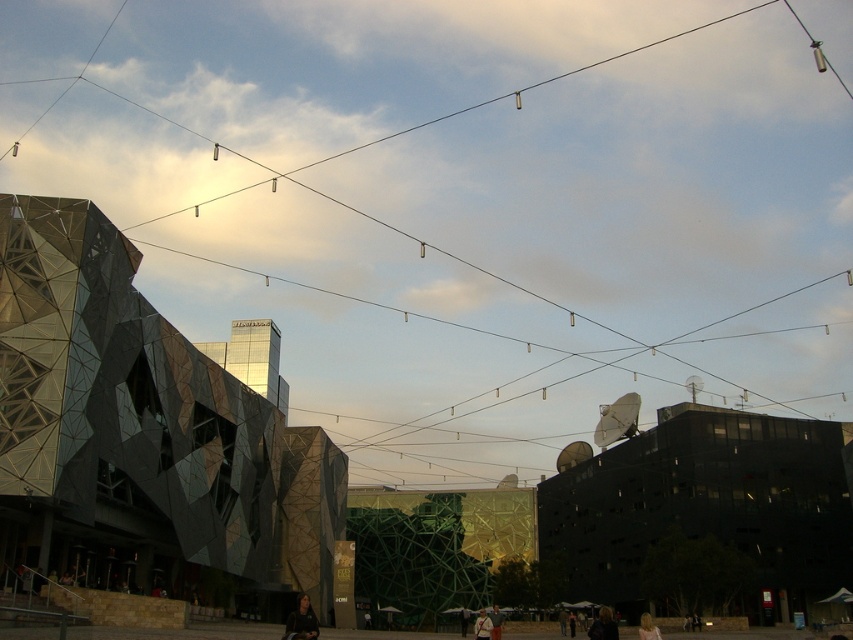
Which is above, dark brown leather jacket at lower center or dark brown leather jacket at lower right?

dark brown leather jacket at lower center

Between dark brown leather jacket at lower center and dark brown leather jacket at lower right, which one appears on the right side from the viewer's perspective?

Positioned to the right is dark brown leather jacket at lower right.

Is point (291, 612) farther from viewer compared to point (589, 627)?

Yes, it is.

Locate an element on the screen. dark brown leather jacket at lower center is located at coordinates (302, 618).

Is point (483, 616) closer to viewer compared to point (497, 621)?

No, (483, 616) is further to viewer.

Can you confirm if light brown leather jacket at center is positioned above dark gray sweater at center?

Incorrect, light brown leather jacket at center is not positioned above dark gray sweater at center.

Image resolution: width=853 pixels, height=640 pixels. Identify the location of light brown leather jacket at center. (482, 625).

Can you confirm if light brown leather jacket at center is positioned below blonde hair at lower right?

Correct, light brown leather jacket at center is located below blonde hair at lower right.

Is point (485, 637) in front of point (642, 614)?

Yes, point (485, 637) is closer to viewer.

Where is `light brown leather jacket at center`? This screenshot has width=853, height=640. light brown leather jacket at center is located at coordinates (482, 625).